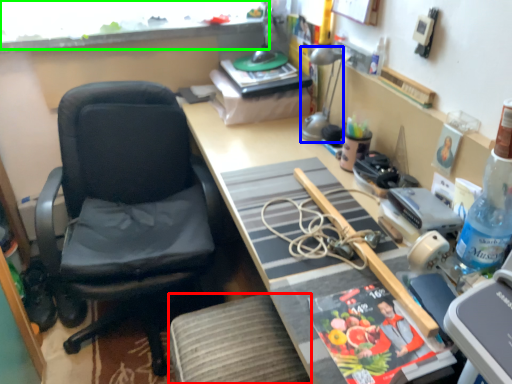
Question: Based on their relative distances, which object is nearer to stool (highlighted by a red box)? Choose from lamp (highlighted by a blue box) and window screen (highlighted by a green box).

Choices:
 (A) lamp
 (B) window screen

Answer: (A)